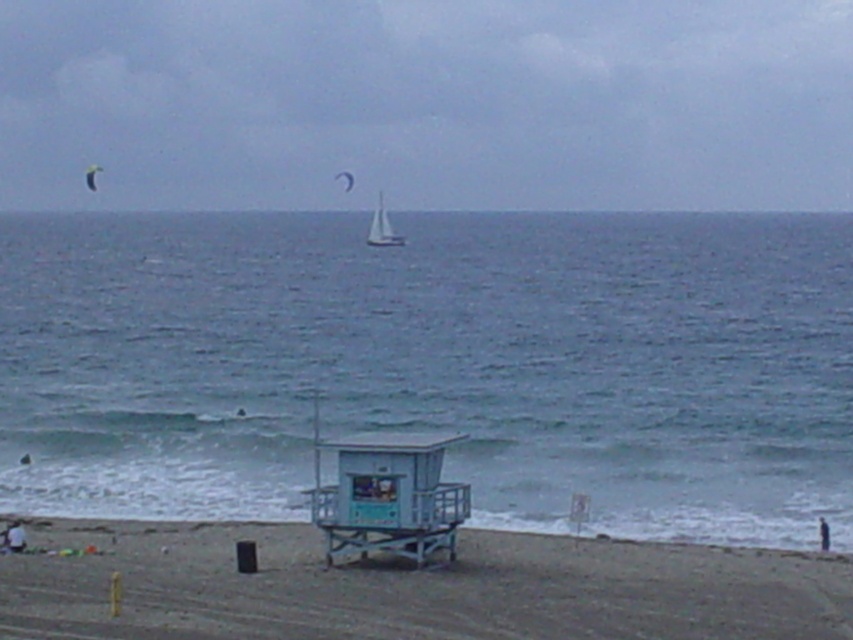
Between point (387, 237) and point (344, 177), which one is positioned behind?

The point (344, 177) is more distant.

Does point (390, 241) come closer to viewer compared to point (347, 170)?

Yes, it is.

Who is more distant from viewer, [386,237] or [337,179]?

The point [337,179] is behind.

You are a GUI agent. You are given a task and a screenshot of the screen. Output one action in this format:
    pyautogui.click(x=<x>, y=<y>)
    Task: Click on the white matte sailboat at center
    The image size is (853, 640).
    Given the screenshot: What is the action you would take?
    pyautogui.click(x=381, y=228)

Is brown sandy beach at lower center to the right of white matte sailboat at center from the viewer's perspective?

Correct, you'll find brown sandy beach at lower center to the right of white matte sailboat at center.

Is brown sandy beach at lower center thinner than white matte sailboat at center?

No.

The height and width of the screenshot is (640, 853). Identify the location of brown sandy beach at lower center. (412, 588).

Which is behind, point (397, 1) or point (3, 538)?

Point (397, 1)

In the scene shown: Who is higher up, matte white sailboat at upper center or white fabric person at lower left?

matte white sailboat at upper center is higher up.

The width and height of the screenshot is (853, 640). In order to click on matte white sailboat at upper center in this screenshot , I will do `click(428, 102)`.